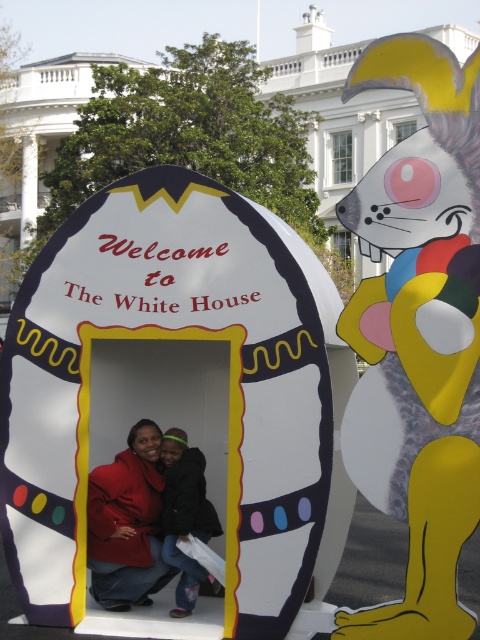
Who is more distant from viewer, (402, 67) or (182, 536)?

Point (182, 536)

Can you confirm if matte yellow and gray cat at right is positioned to the left of denim pants at center?

Incorrect, matte yellow and gray cat at right is not on the left side of denim pants at center.

Where is `matte yellow and gray cat at right`? Image resolution: width=480 pixels, height=640 pixels. matte yellow and gray cat at right is located at coordinates (418, 333).

Does point (402, 380) lie behind point (123, 586)?

No, it is not.

Is point (396, 220) less distant than point (86, 518)?

Yes, it is.

You are a GUI agent. You are given a task and a screenshot of the screen. Output one action in this format:
    pyautogui.click(x=<x>, y=<y>)
    Task: Click on the matte yellow and gray cat at right
    Image resolution: width=480 pixels, height=640 pixels.
    Given the screenshot: What is the action you would take?
    pyautogui.click(x=418, y=333)

Based on the photo, can you confirm if matte red coat at center is wider than denim pants at center?

Yes.

Who is more forward, (130, 435) or (187, 500)?

Point (187, 500)

Find the location of a particular element. This screenshot has height=640, width=480. matte red coat at center is located at coordinates (128, 522).